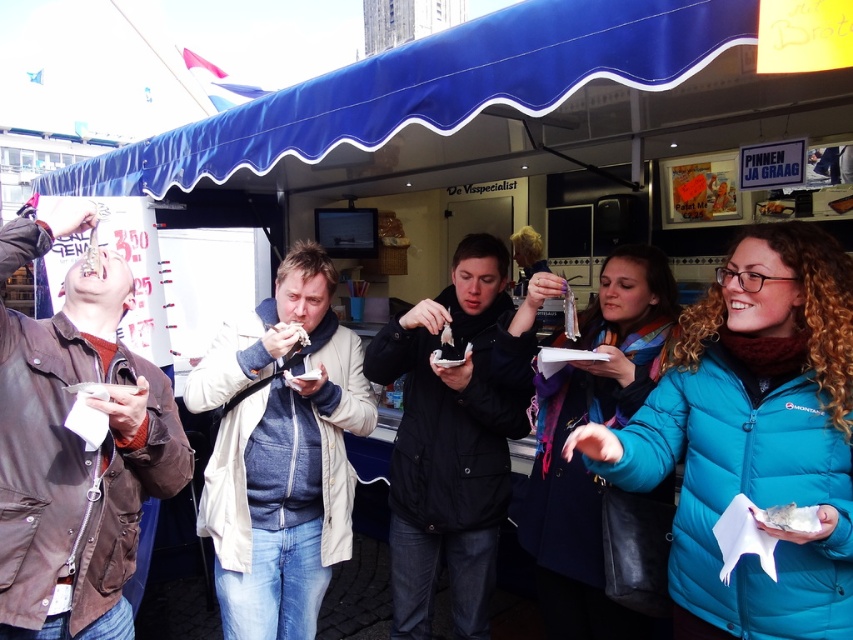
Question: Which point is closer to the camera?

Choices:
 (A) blue wool scarf at center
 (B) shiny silver fish at center

Answer: (A)

Question: Which object is closer to the camera taking this photo?

Choices:
 (A) blonde hair at center
 (B) white paper at center
 (C) beige fabric jacket at center
 (D) shiny silver spoon at center

Answer: (C)

Question: Is beige fabric jacket at center smaller than white paper at center?

Choices:
 (A) no
 (B) yes

Answer: (A)

Question: Does blue fabric canopy at upper center have a lesser width compared to shiny silver fish at center?

Choices:
 (A) yes
 (B) no

Answer: (B)

Question: Does teal puffer jacket at center appear on the left side of blue fabric canopy at upper center?

Choices:
 (A) yes
 (B) no

Answer: (B)

Question: Which object appears closest to the camera in this image?

Choices:
 (A) white paper at center
 (B) brown leather jacket at left
 (C) blue fabric canopy at upper center
 (D) shiny silver fish at center

Answer: (C)